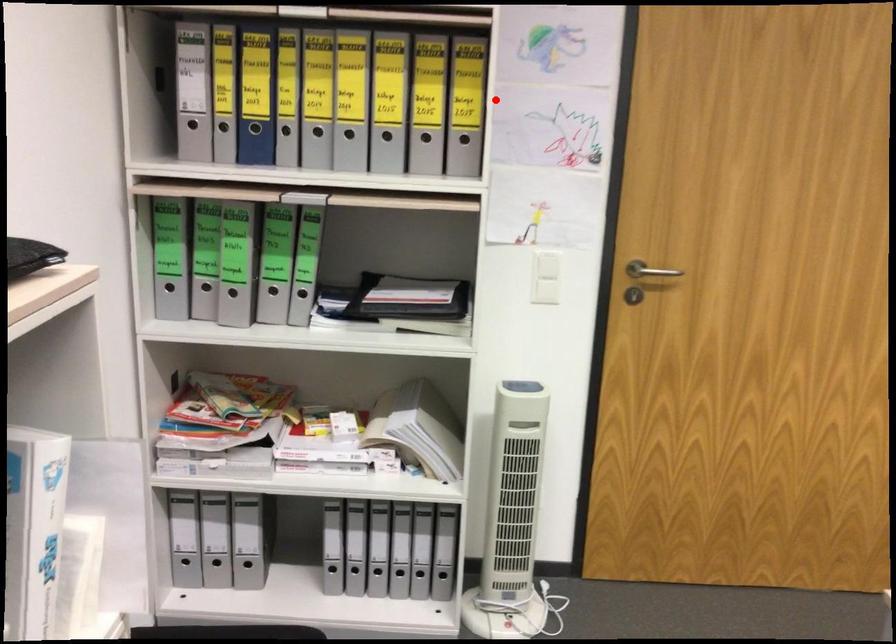
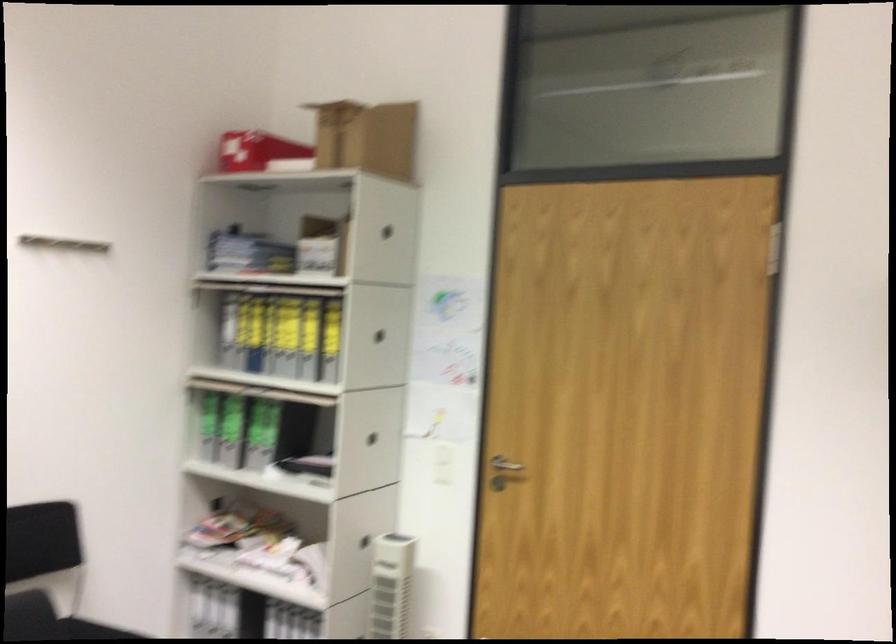
Question: I am providing you with two images of the same scene from different viewpoints. In image1, a red point is highlighted. Considering the same 3D point in image2, which of the following is correct?

Choices:
 (A) It is closer
 (B) It is farther

Answer: (B)